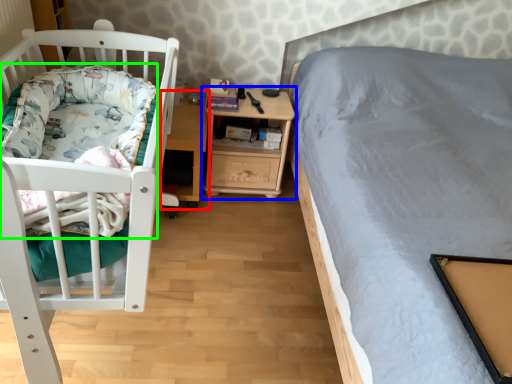
Question: Which object is the farthest from table (highlighted by a red box)? Choose among these: nightstand (highlighted by a blue box) or blanket (highlighted by a green box).

Choices:
 (A) nightstand
 (B) blanket

Answer: (B)